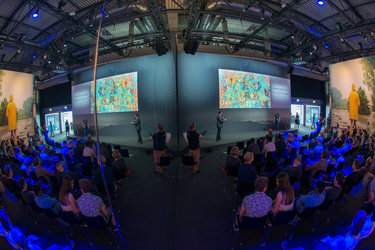
Identify the location of ceiling. (309, 18), (56, 25).